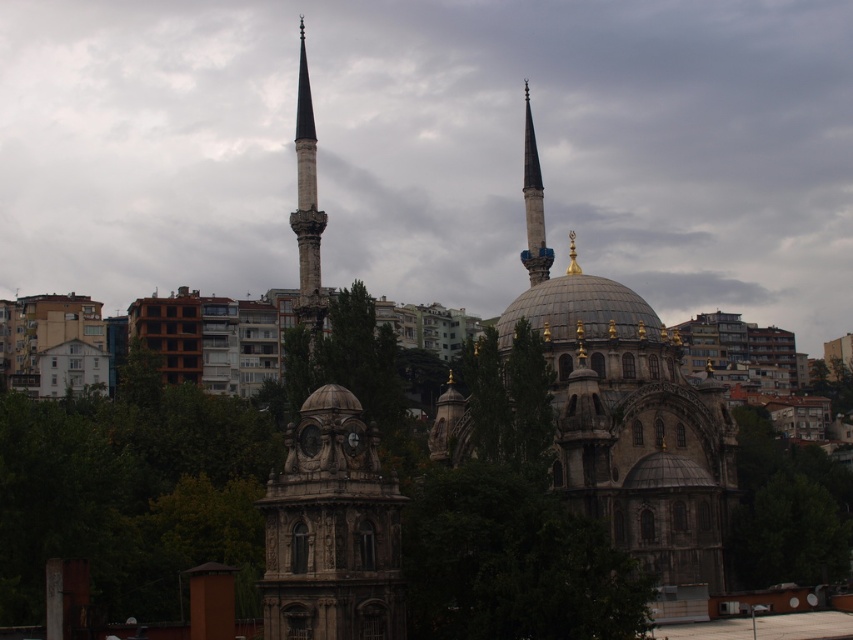
The height and width of the screenshot is (640, 853). What do you see at coordinates (306, 211) in the screenshot? I see `smooth stone minaret at center` at bounding box center [306, 211].

At what (x,y) coordinates should I click in order to perform the action: click on smooth stone minaret at center. Please return your answer as a coordinate pair (x, y). The image size is (853, 640). Looking at the image, I should click on (306, 211).

Where is `green leafy tree at lower left`? green leafy tree at lower left is located at coordinates (131, 493).

Between point (27, 540) and point (437, 417), which one is positioned in front?

Point (27, 540) is more forward.

I want to click on green leafy tree at lower left, so click(x=131, y=493).

Is stone dome at center wider than green leafy tree at center?

Yes, stone dome at center is wider than green leafy tree at center.

Between stone dome at center and green leafy tree at center, which one appears on the right side from the viewer's perspective?

stone dome at center is more to the right.

Is point (578, 429) positioned behind point (485, 470)?

Yes.

Find the location of `stone dome at center`. stone dome at center is located at coordinates (631, 426).